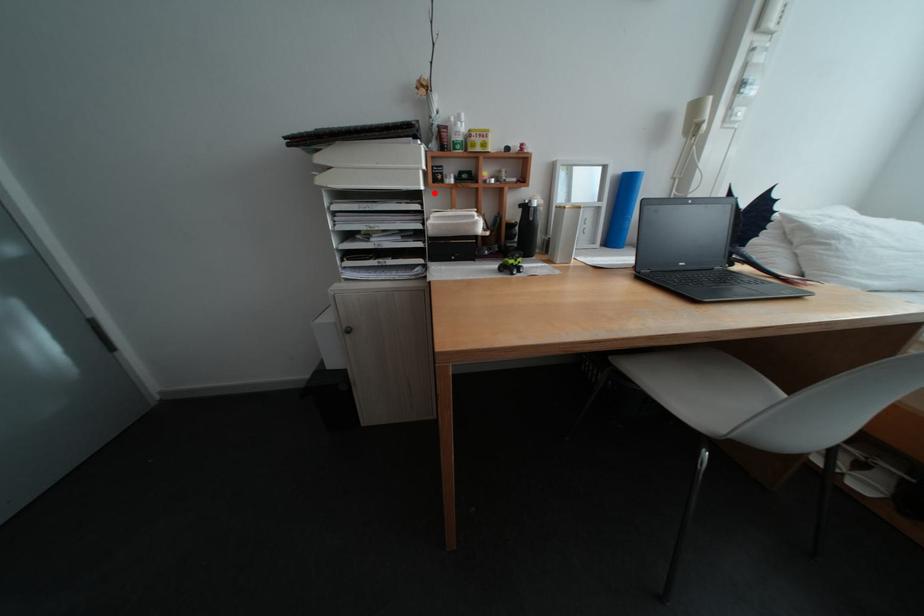
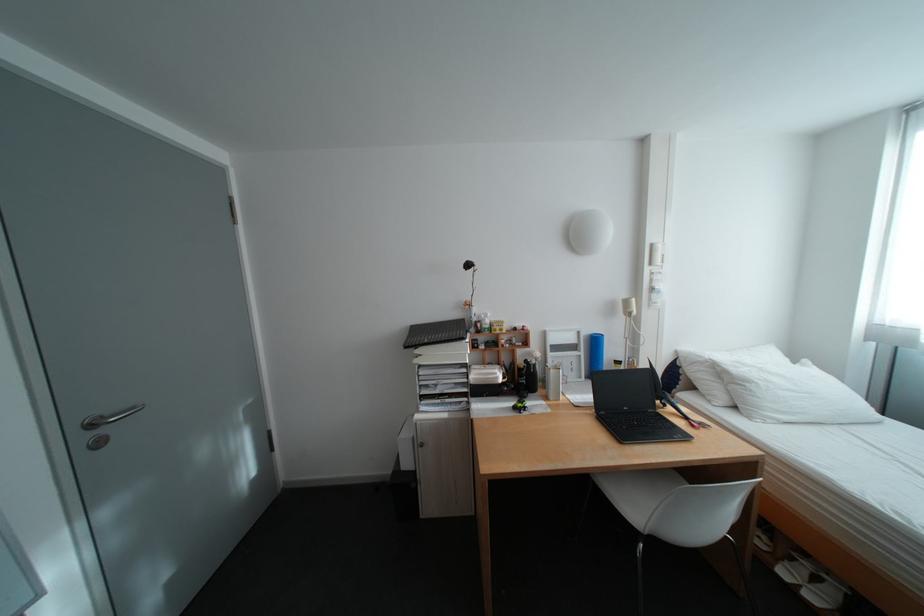
Question: I am providing you with two images of the same scene from different viewpoints. A red point is marked on the first image. Can you still see the location of the red point in image 2?

Choices:
 (A) Yes
 (B) No

Answer: (A)